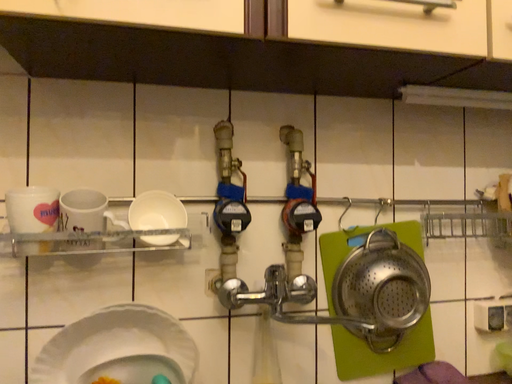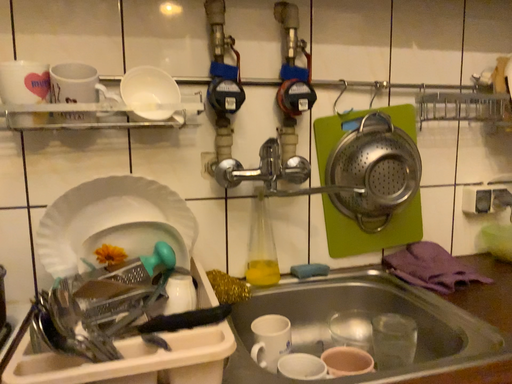
Question: Which way did the camera rotate in the video?

Choices:
 (A) rotated downward
 (B) rotated upward

Answer: (A)